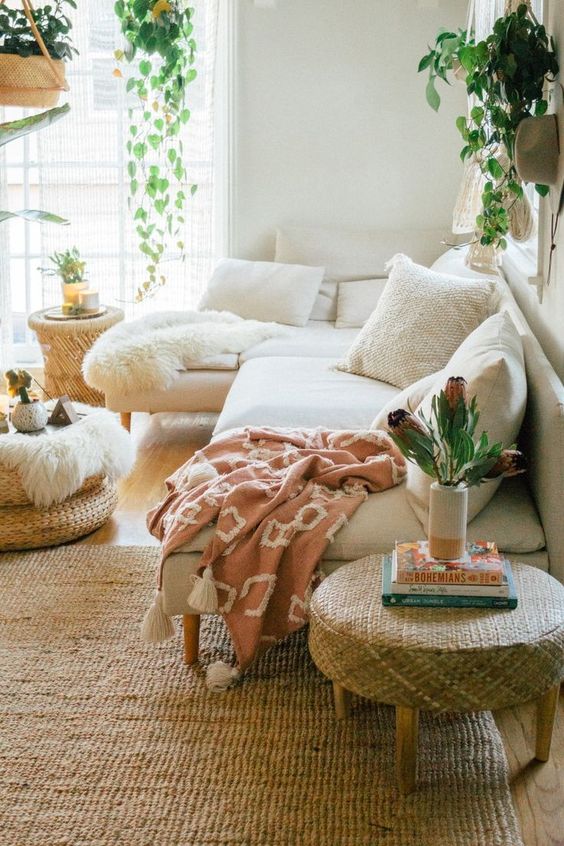
Where is `white pillows`? The height and width of the screenshot is (846, 564). white pillows is located at coordinates (486, 383), (440, 328), (284, 286), (354, 303), (327, 255).